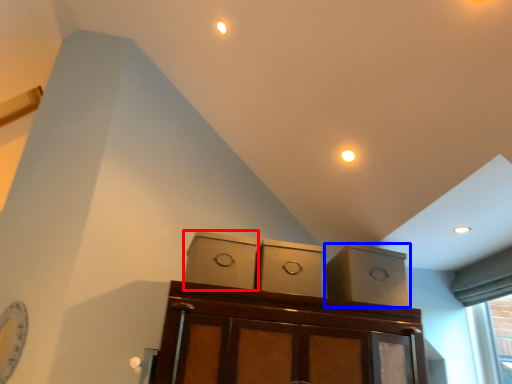
Question: Among these objects, which one is farthest to the camera, cabinetry (highlighted by a red box) or cabinetry (highlighted by a blue box)?

Choices:
 (A) cabinetry
 (B) cabinetry

Answer: (B)